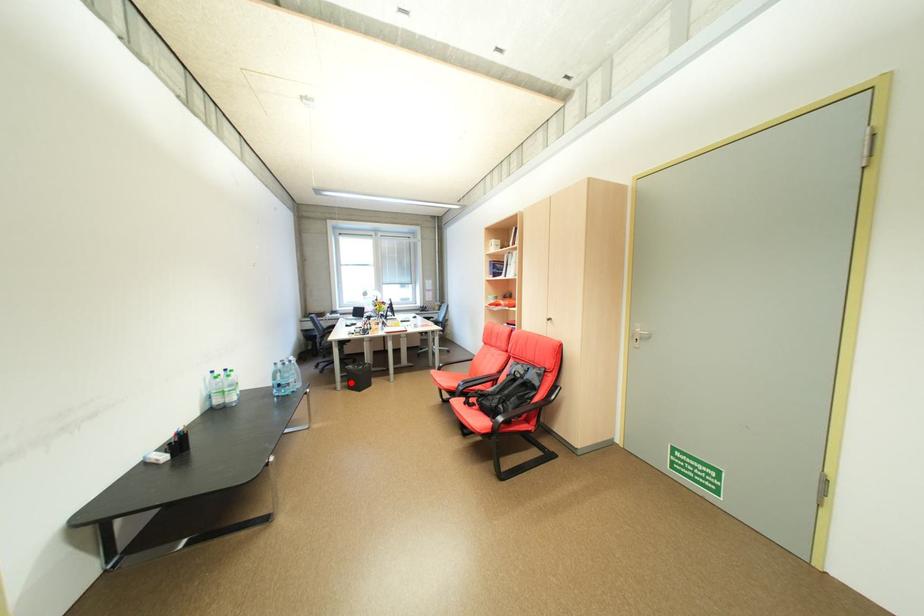
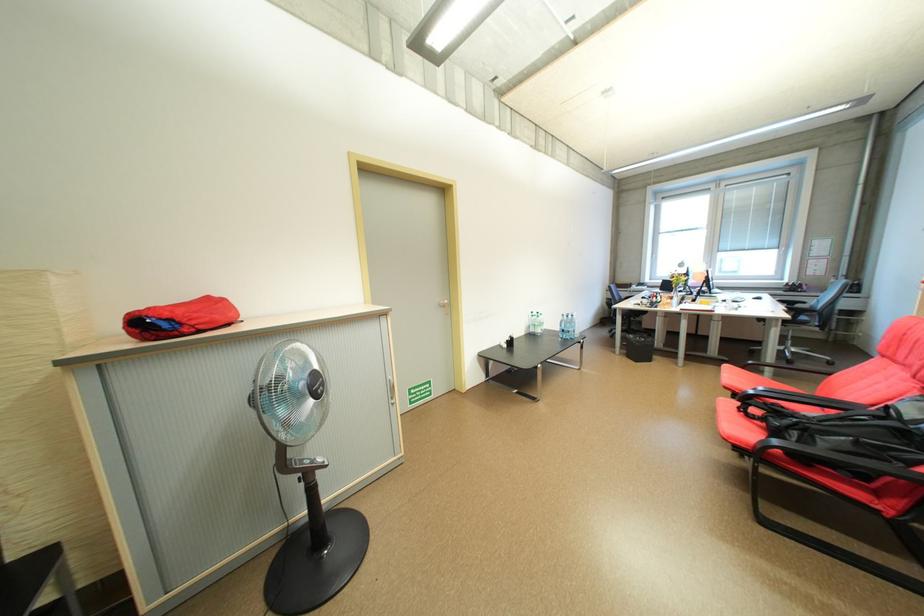
The point at the highlighted location is marked in the first image. Where is the corresponding point in the second image?

(630, 349)